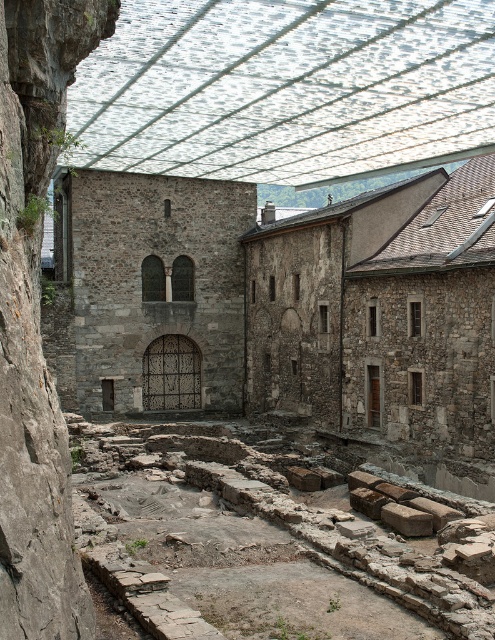
From the picture: Which is more to the right, gray stone ruins at lower center or rustic stone ruins at center?

Positioned to the right is gray stone ruins at lower center.

This screenshot has height=640, width=495. Describe the element at coordinates (244, 544) in the screenshot. I see `gray stone ruins at lower center` at that location.

Which is in front, point (369, 570) or point (166, 216)?

Point (369, 570) is more forward.

You are a GUI agent. You are given a task and a screenshot of the screen. Output one action in this format:
    pyautogui.click(x=<x>, y=<y>)
    Task: Click on the gray stone ruins at lower center
    The height and width of the screenshot is (640, 495).
    Given the screenshot: What is the action you would take?
    pyautogui.click(x=244, y=544)